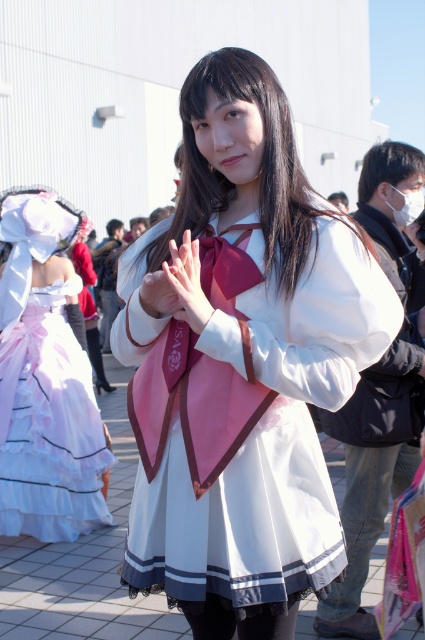
Does white satin dress at center have a larger size compared to pink satin hand at center?

Correct, white satin dress at center is larger in size than pink satin hand at center.

Between point (314, 552) and point (169, 269), which one is positioned behind?

Point (314, 552)

Does point (272, 115) lie behind point (175, 248)?

That is True.

In order to click on white satin dress at center in this screenshot , I will do tap(243, 365).

Can you confirm if white lace dress at left is bigger than pink satin hand at center?

Yes.

Is white lace dress at left further to camera compared to pink satin hand at center?

Yes, white lace dress at left is further from the viewer.

The height and width of the screenshot is (640, 425). Describe the element at coordinates (45, 381) in the screenshot. I see `white lace dress at left` at that location.

Identify the location of white lace dress at left. Image resolution: width=425 pixels, height=640 pixels. (45, 381).

Can you confirm if white satin dress at center is positioned to the right of white lace dress at left?

Indeed, white satin dress at center is positioned on the right side of white lace dress at left.

Between white satin dress at center and white lace dress at left, which one is positioned lower?

white lace dress at left is lower down.

Between point (155, 461) and point (61, 230), which one is positioned in front?

Positioned in front is point (155, 461).

Identify the location of white satin dress at center. Image resolution: width=425 pixels, height=640 pixels. (243, 365).